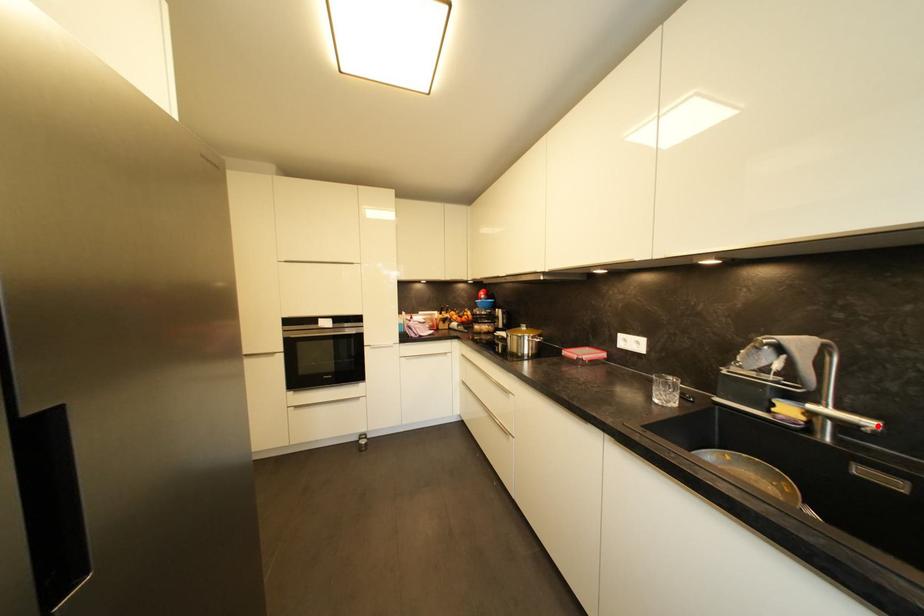
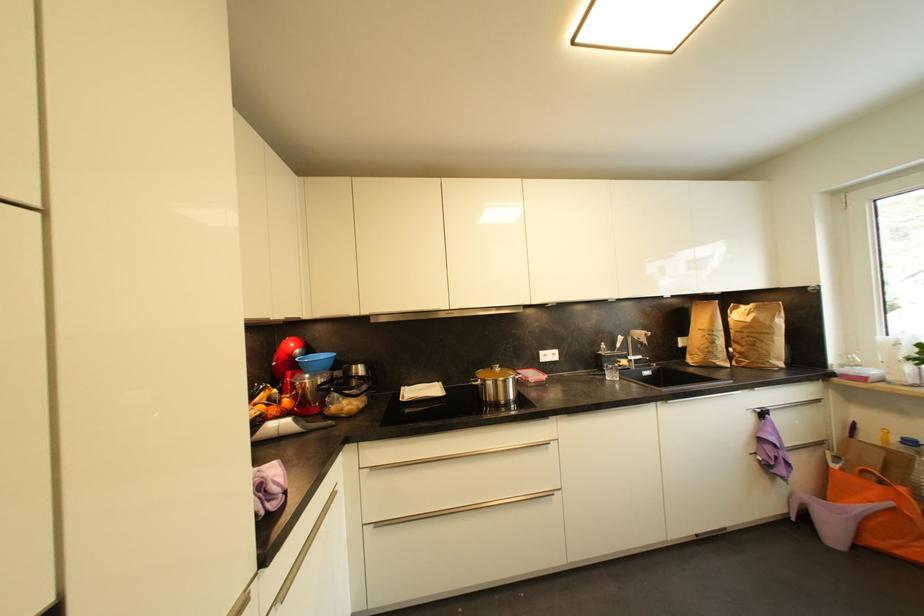
Locate, in the second image, the point that corresponds to the highlighted location in the first image.

(645, 359)